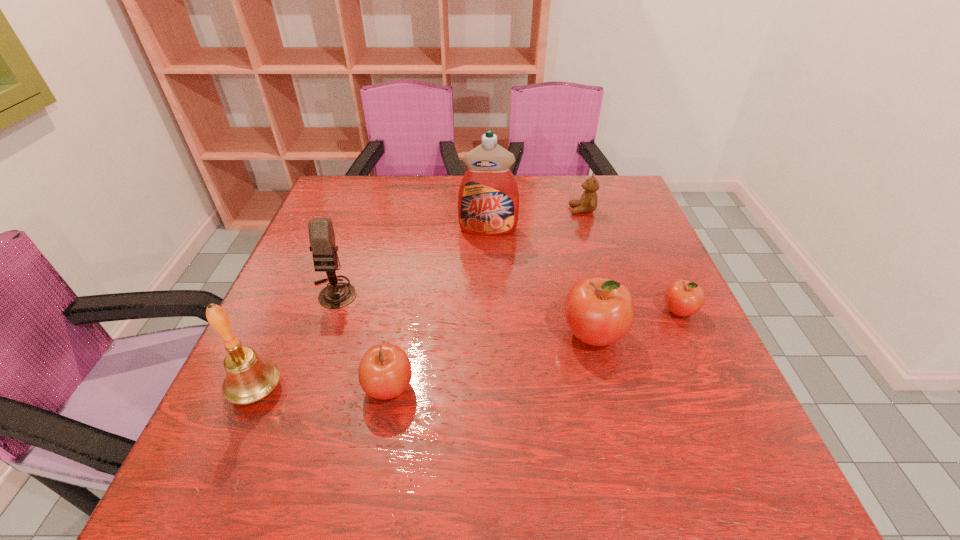
Identify the location of the leftmost apple. The image size is (960, 540). (385, 372).

Image resolution: width=960 pixels, height=540 pixels. I want to click on the fifth object from right to left, so click(385, 372).

You are a GUI agent. You are given a task and a screenshot of the screen. Output one action in this format:
    pyautogui.click(x=<x>, y=<y>)
    Task: Click on the tallest apple
    This screenshot has width=960, height=540.
    Given the screenshot: What is the action you would take?
    pyautogui.click(x=598, y=311)

I want to click on the shortest apple, so click(x=683, y=298).

Identify the location of the rightmost object. This screenshot has width=960, height=540. (683, 298).

In order to click on the tallest object in this screenshot , I will do `click(488, 200)`.

Locate an element on the screen. The height and width of the screenshot is (540, 960). detergent is located at coordinates (488, 200).

This screenshot has height=540, width=960. Identify the location of microphone. (324, 250).

At what (x,y) coordinates should I click in order to perform the action: click on teddy bear. Please return your answer as a coordinate pair (x, y). The height and width of the screenshot is (540, 960). Looking at the image, I should click on (588, 203).

Image resolution: width=960 pixels, height=540 pixels. Find the location of `bell`. bell is located at coordinates (250, 378).